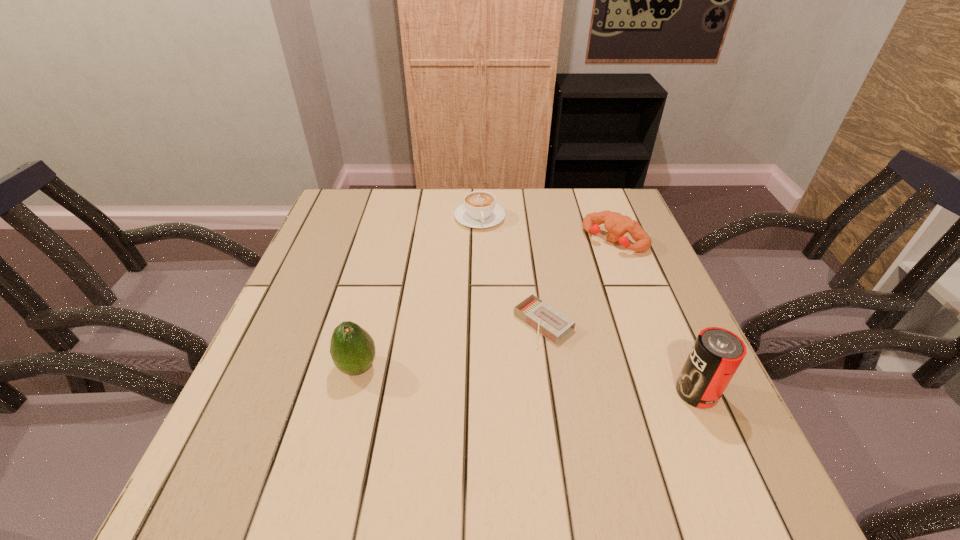
Locate an element on the screen. free spot on the desktop that is between the second tallest object and the tallest object and is positioned with the gloves of the puncher facing forward is located at coordinates (481, 376).

Image resolution: width=960 pixels, height=540 pixels. I want to click on free space on the desktop that is between the avocado and the tallest object and is positioned on the striking surface of the third farthest object, so click(x=479, y=376).

Where is `vacant space on the desktop that is between the avocado and the tallest object and is positioned on the side of the second shortest object with the handle`? vacant space on the desktop that is between the avocado and the tallest object and is positioned on the side of the second shortest object with the handle is located at coordinates (518, 379).